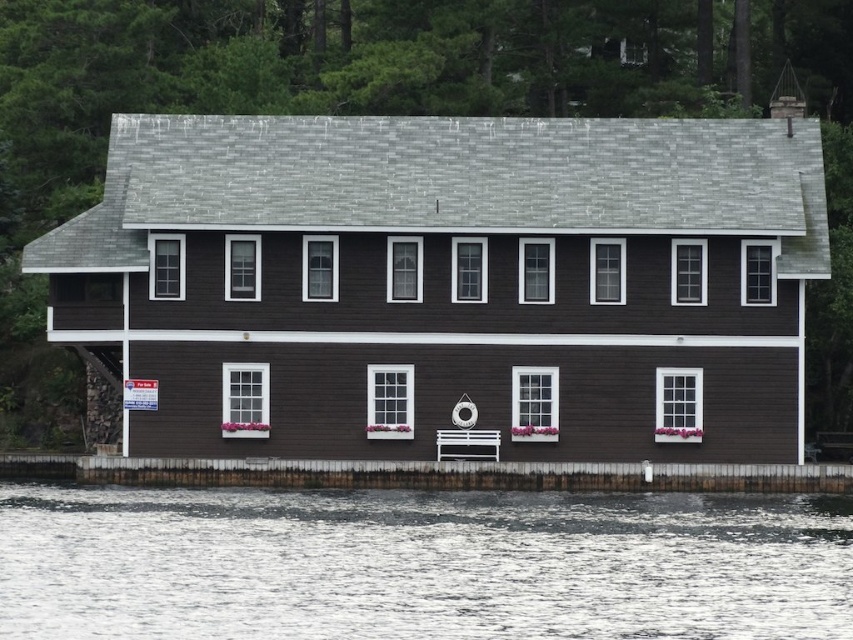
Is point (756, 564) positioned behind point (483, 448)?

No.

Between point (735, 563) and point (456, 429), which one is positioned behind?

Positioned behind is point (456, 429).

This screenshot has width=853, height=640. I want to click on clear water at lower center, so click(x=419, y=563).